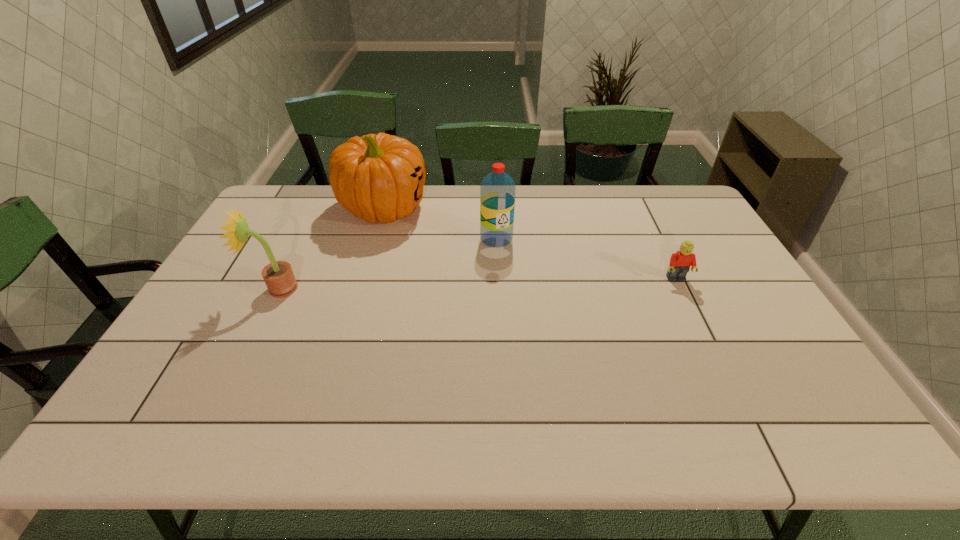
You are a GUI agent. You are given a task and a screenshot of the screen. Output one action in this format:
    pyautogui.click(x=<x>, y=<y>)
    Task: Click on the blank space located on the front label of the water bottle
    The image size is (960, 540).
    Given the screenshot: What is the action you would take?
    pyautogui.click(x=521, y=326)

Where is `vacant point located on the surface of the pumpkin`? vacant point located on the surface of the pumpkin is located at coordinates (416, 275).

At what (x,y) coordinates should I click in order to perform the action: click on free region located on the surface of the pumpkin. Please return your answer as a coordinate pair (x, y). Looking at the image, I should click on (425, 295).

The width and height of the screenshot is (960, 540). I want to click on free space located on the surface of the pumpkin, so click(x=403, y=250).

Identify the location of object positioned at the far edge. (378, 178).

Find the location of `object that is at the left edge`. object that is at the left edge is located at coordinates (279, 278).

I want to click on object that is at the right edge, so click(x=680, y=262).

Identify the location of free space at the far edge of the desktop. (564, 205).

Find the location of a particular element. free location at the near edge of the desktop is located at coordinates (268, 363).

I want to click on free space at the left edge of the desktop, so click(286, 221).